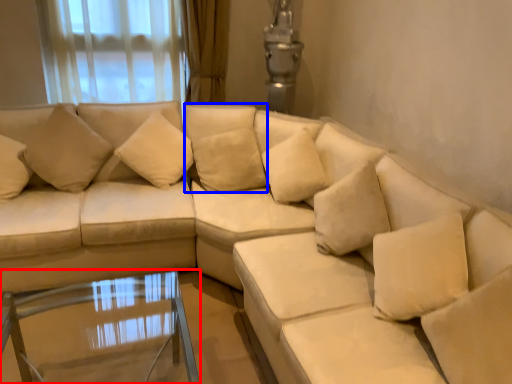
Question: Which point is closer to the camera, table (highlighted by a red box) or pillow (highlighted by a blue box)?

Choices:
 (A) table
 (B) pillow

Answer: (A)